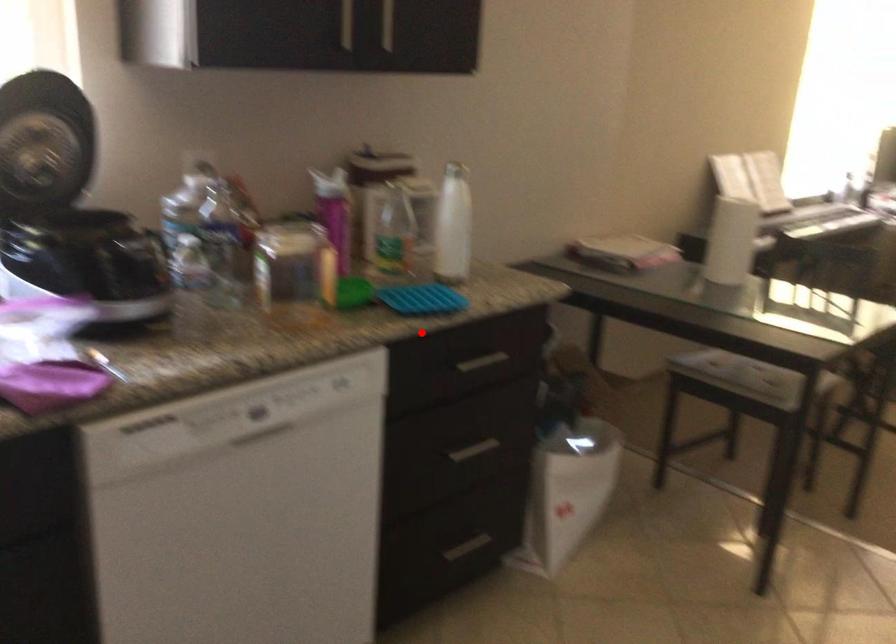
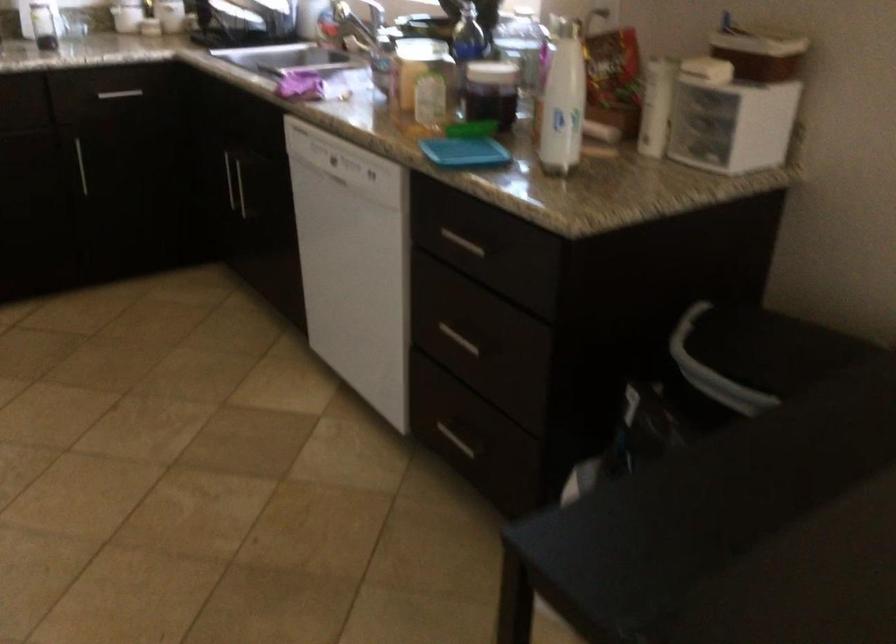
Locate, in the second image, the point that corresponds to the highlighted location in the first image.

(462, 243)